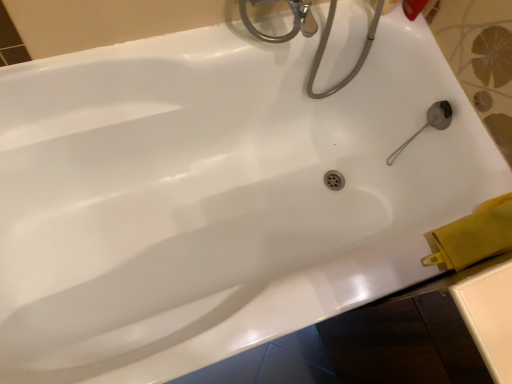
What is the approximate width of brushed metal hose at upper center?

4.33 inches.

Where is `brushed metal hose at upper center`? The image size is (512, 384). brushed metal hose at upper center is located at coordinates (325, 46).

Describe the element at coordinates (325, 46) in the screenshot. I see `brushed metal hose at upper center` at that location.

Where is `brushed metal hose at upper center`? This screenshot has height=384, width=512. brushed metal hose at upper center is located at coordinates (325, 46).